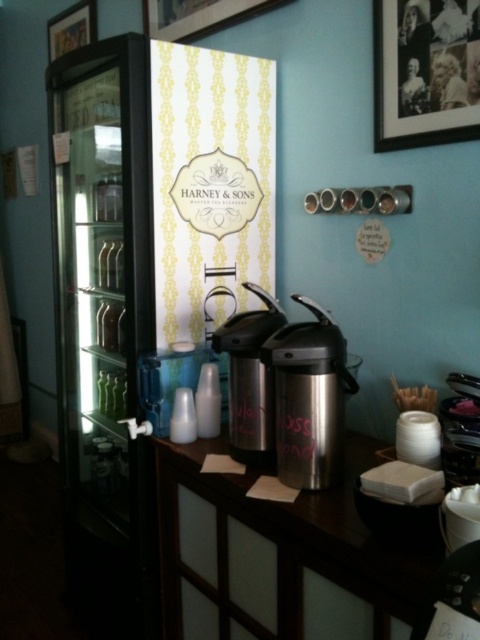
Question: Which object is closer to the camera taking this photo?

Choices:
 (A) stainless steel carafe at center
 (B) wooden picture frame at upper right
 (C) translucent plastic cup at lower center

Answer: (A)

Question: Is wooden picture frame at upper right to the right of wooden picture frame at upper center from the viewer's perspective?

Choices:
 (A) yes
 (B) no

Answer: (A)

Question: Which object is the farthest from the transparent plastic bottle at center?

Choices:
 (A) wooden picture frame at upper left
 (B) wooden picture frame at upper center
 (C) translucent plastic cup at lower center

Answer: (A)

Question: Is stainless steel carafe at center thinner than wooden picture frame at upper left?

Choices:
 (A) no
 (B) yes

Answer: (B)

Question: Which of the following is the farthest from the observer?

Choices:
 (A) (291, 348)
 (B) (193, 417)
 (C) (215, 10)

Answer: (C)

Question: Is wooden picture frame at upper left bigger than transparent plastic bottle at center?

Choices:
 (A) no
 (B) yes

Answer: (B)